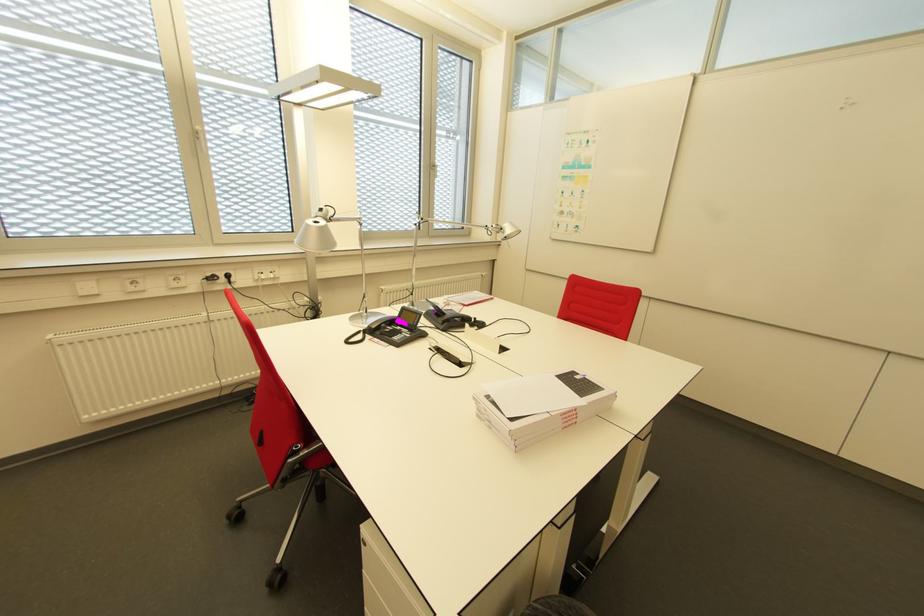
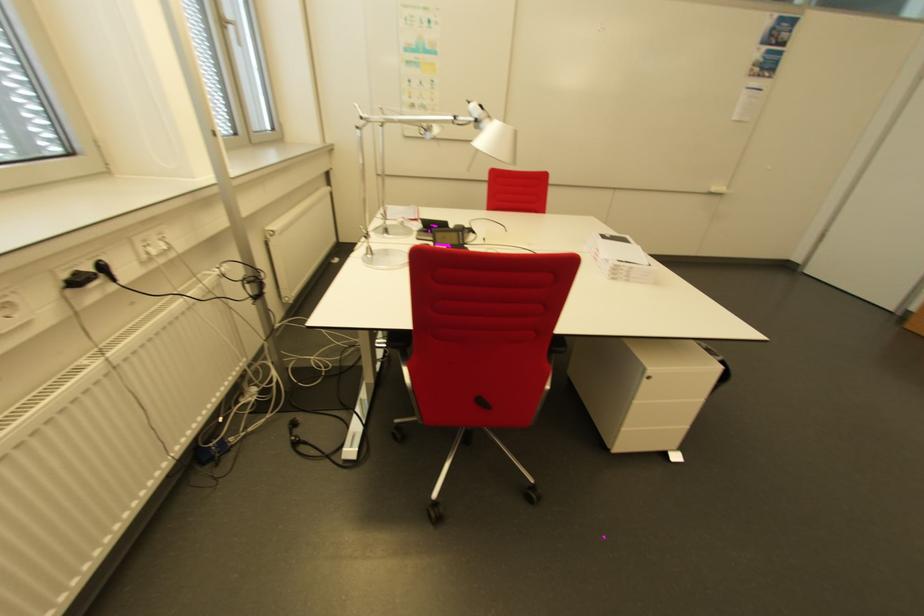
Locate, in the second image, the point that corresponds to pixel 581 378 in the first image.

(614, 237)